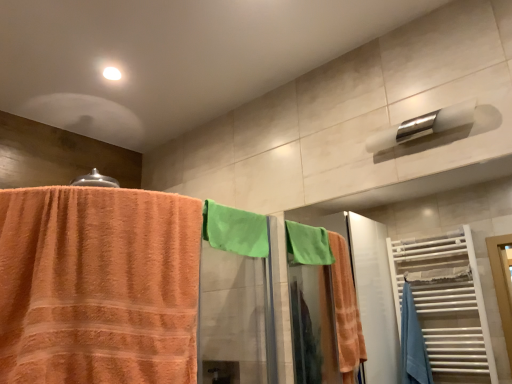
Question: Is white glossy towel bar at upper right inside the boundaries of green terry cloth towel at center, or outside?

Choices:
 (A) outside
 (B) inside

Answer: (A)

Question: In terms of height, does white glossy towel bar at upper right look taller or shorter compared to green terry cloth towel at center?

Choices:
 (A) tall
 (B) short

Answer: (B)

Question: Which object is the closest to the orange terry cloth towel at left?

Choices:
 (A) white glossy towel bar at upper right
 (B) green terry cloth towel at center

Answer: (B)

Question: Which object is positioned closest to the green terry cloth towel at center?

Choices:
 (A) white glossy towel bar at upper right
 (B) orange terry cloth towel at left

Answer: (B)